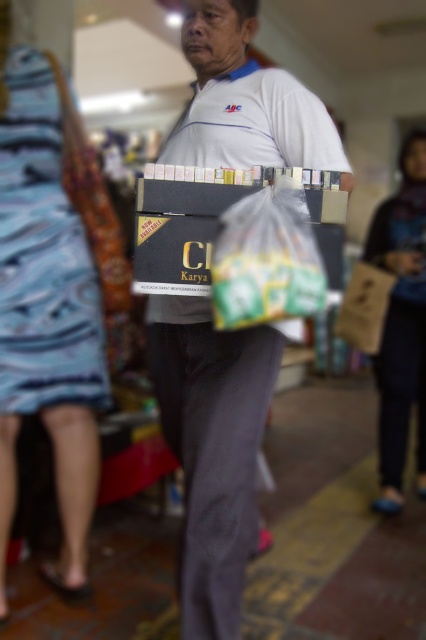
Question: Estimate the real-world distances between objects in this image. Which object is farther from the blue fabric bag at lower right?

Choices:
 (A) white matte box at center
 (B) blue patterned dress at lower left

Answer: (B)

Question: Which object appears farthest from the camera in this image?

Choices:
 (A) white matte box at center
 (B) blue patterned dress at lower left

Answer: (B)

Question: Can you confirm if white matte box at center is positioned to the right of blue patterned dress at lower left?

Choices:
 (A) yes
 (B) no

Answer: (A)

Question: Among these points, which one is farthest from the camera?

Choices:
 (A) (227, 532)
 (B) (14, 77)
 (C) (385, 212)

Answer: (C)

Question: Does white matte box at center come in front of blue fabric bag at lower right?

Choices:
 (A) no
 (B) yes

Answer: (B)

Question: Does white matte box at center appear on the right side of blue patterned dress at lower left?

Choices:
 (A) no
 (B) yes

Answer: (B)